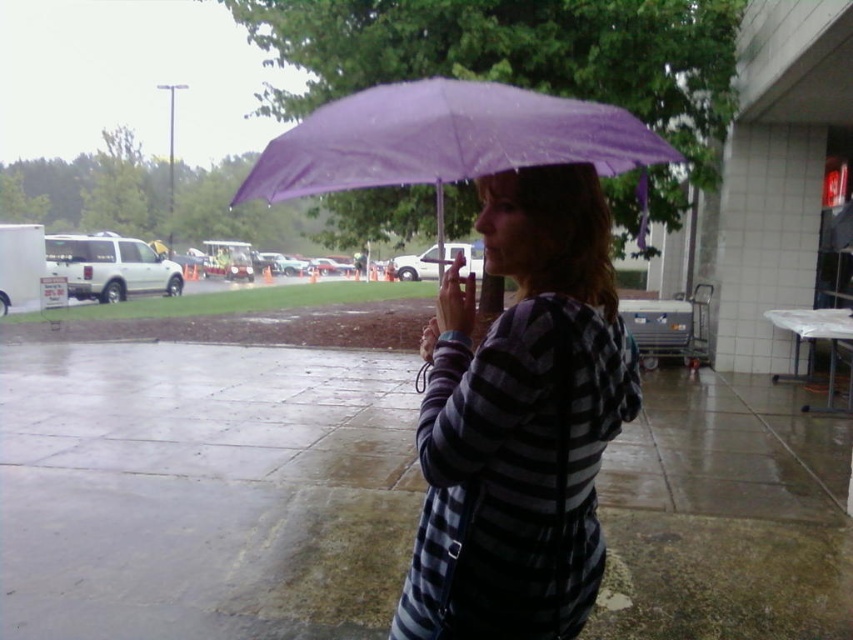
Where is the striped fabric hoodie at center located in the image?

The striped fabric hoodie at center is located at point (520,420) in the image.

From the picture: You are a delivery person trying to reach the woman under the purple matte umbrella at center. You see the striped fabric hoodie at center in your path. Can you walk around it without getting too close?

The striped fabric hoodie at center is further to the viewer than the purple matte umbrella at center, so the hoodie is closer to you. You can walk around it by moving to the side since it is in front of the umbrella.